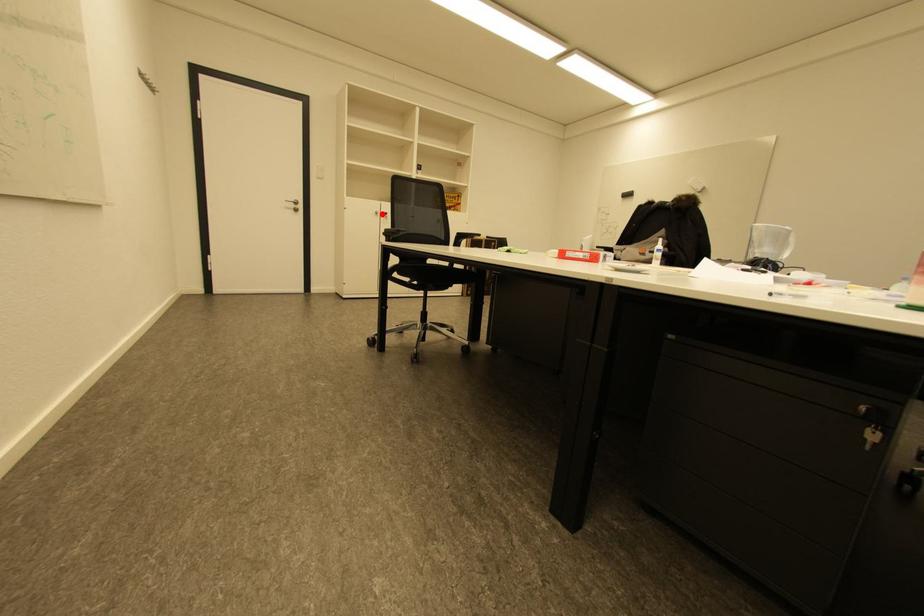
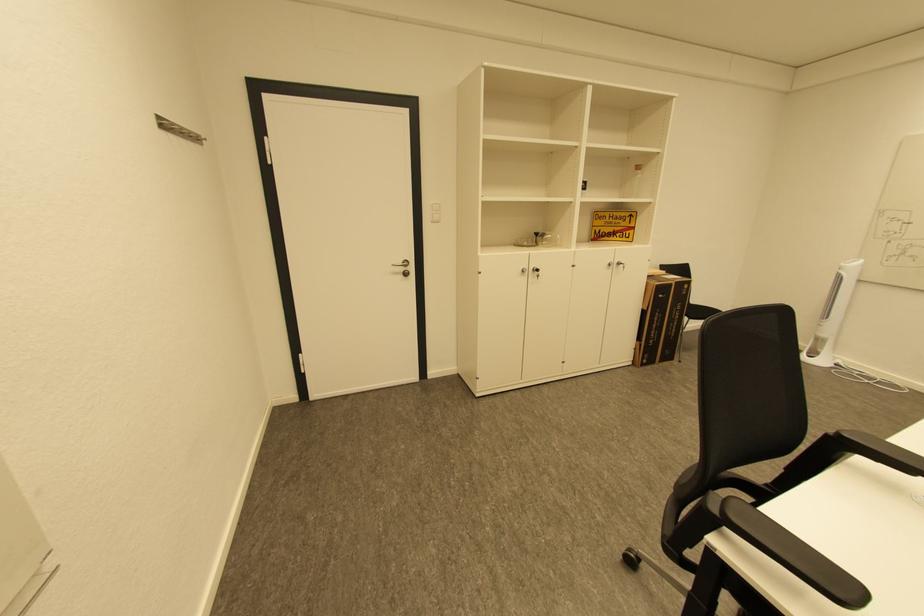
Question: I am providing you with two images of the same scene from different viewpoints. In image1, a red point is highlighted. Considering the same 3D point in image2, which of the following is correct?

Choices:
 (A) It is closer
 (B) It is farther

Answer: (B)